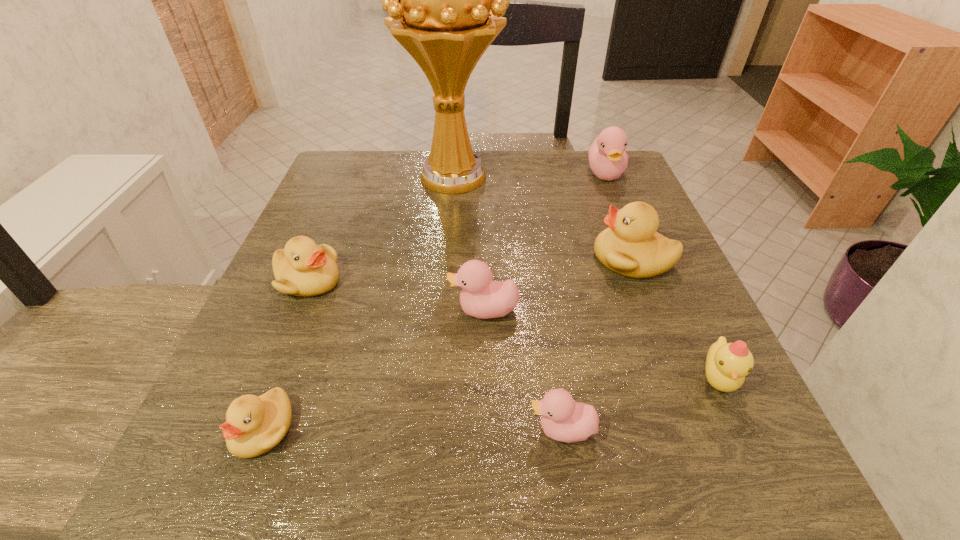
What are the coordinates of `vacant space located on the front-facing side of the biggest yellow duckling` in the screenshot? It's located at (547, 259).

The image size is (960, 540). In order to click on free region located 0.300m on the front-facing side of the biggest yellow duckling in this screenshot , I will do `click(440, 259)`.

At what (x,y) coordinates should I click in order to perform the action: click on free space located 0.400m on the front-facing side of the biggest yellow duckling. Please return your answer as a coordinate pair (x, y). The height and width of the screenshot is (540, 960). Looking at the image, I should click on (388, 259).

In order to click on free space located on the front-facing side of the second farthest pink duckling in this screenshot , I will do `click(280, 310)`.

At what (x,y) coordinates should I click in order to perform the action: click on blank area located 0.320m on the front-facing side of the second farthest pink duckling. Please return your answer as a coordinate pair (x, y). Looking at the image, I should click on (263, 310).

You are a GUI agent. You are given a task and a screenshot of the screen. Output one action in this format:
    pyautogui.click(x=<x>, y=<y>)
    Task: Click on the vacant region located on the front-facing side of the second farthest pink duckling
    This screenshot has height=540, width=960.
    Given the screenshot: What is the action you would take?
    pyautogui.click(x=379, y=310)

The height and width of the screenshot is (540, 960). In order to click on vacant space located on the front-facing side of the smallest pink duckling in this screenshot , I will do `click(255, 430)`.

The image size is (960, 540). In order to click on vacant area located on the front-facing side of the smallest pink duckling in this screenshot , I will do 485,430.

I want to click on free space located 0.270m on the front-facing side of the smallest pink duckling, so click(329, 430).

Identify the location of trophy_cup at the far edge. (445, 0).